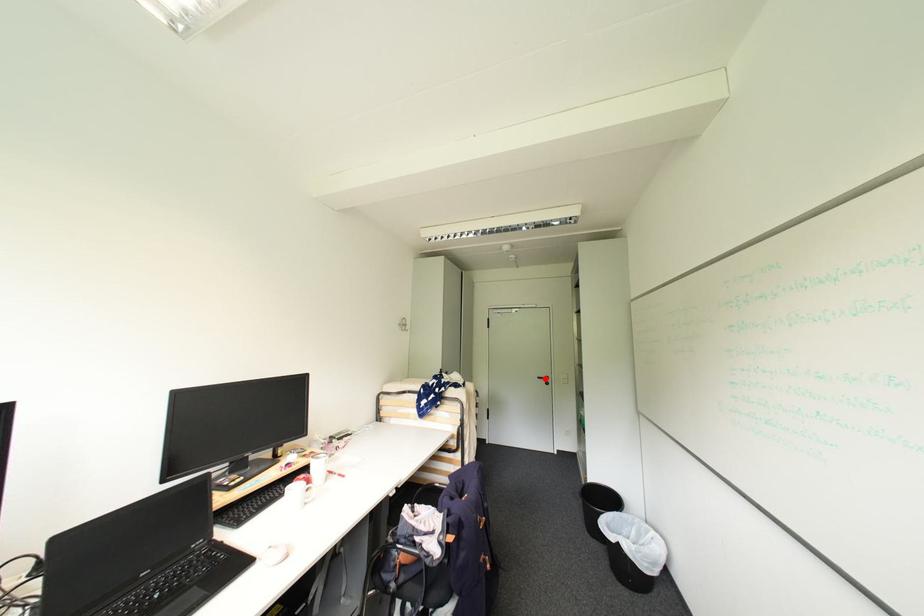
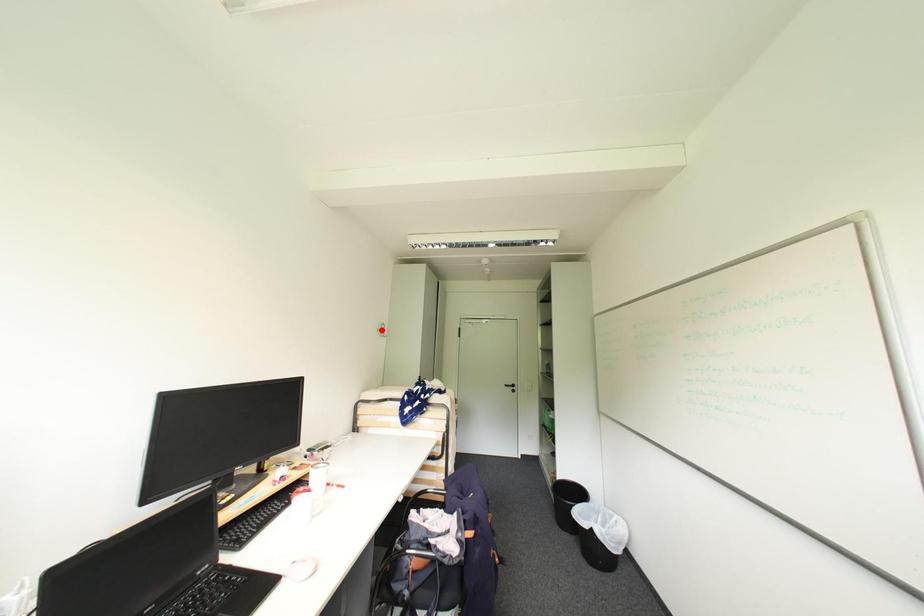
I am providing you with two images of the same scene from different viewpoints. A red point is marked on the first image and another point is marked on the second image. Does the point marked in image1 correspond to the same location as the one in image2?

No